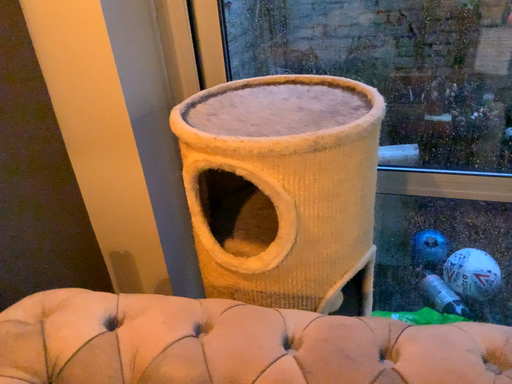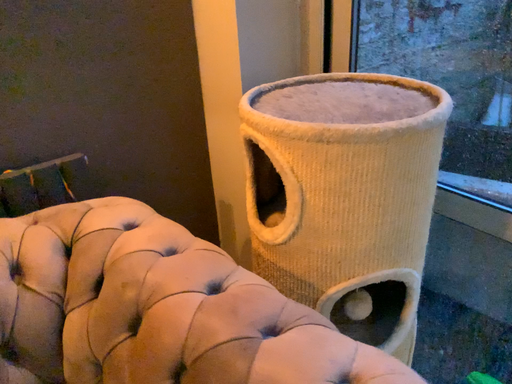
Question: Which way did the camera rotate in the video?

Choices:
 (A) rotated left
 (B) rotated right

Answer: (A)